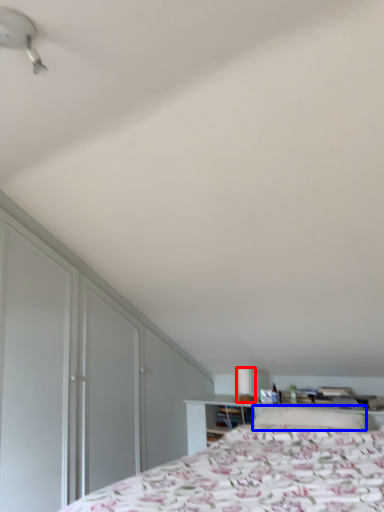
Question: Which point is closer to the camera, table lamp (highlighted by a red box) or pillow (highlighted by a blue box)?

Choices:
 (A) table lamp
 (B) pillow

Answer: (B)